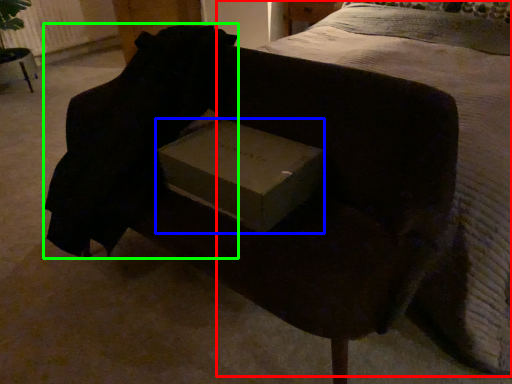
Question: Which object is positioned closest to bed (highlighted by a red box)? Select from box (highlighted by a blue box) and back (highlighted by a green box).

Choices:
 (A) box
 (B) back

Answer: (A)